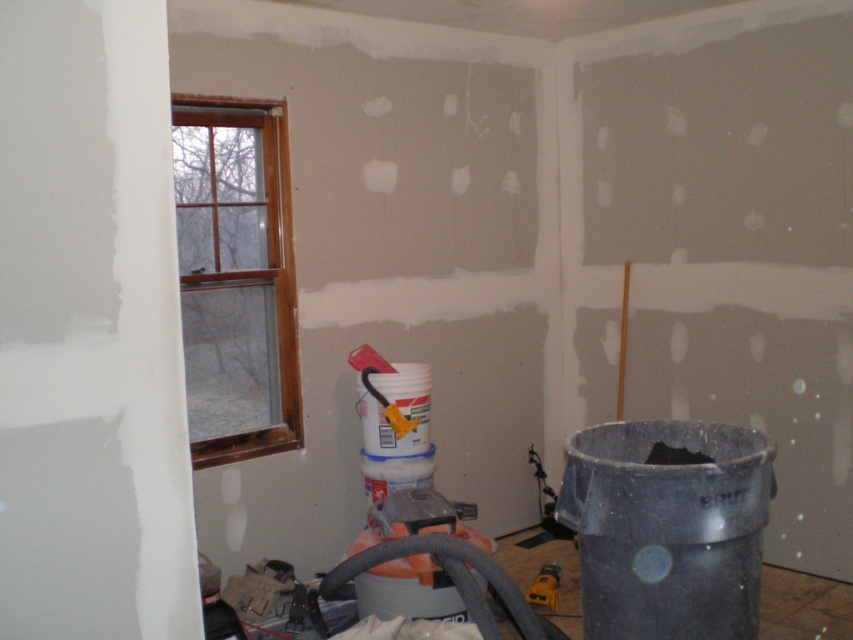
Question: Is brown wooden window at upper left above yellow plastic tool at lower center?

Choices:
 (A) no
 (B) yes

Answer: (B)

Question: Which point appears closest to the camera in this image?

Choices:
 (A) (547, 564)
 (B) (210, 362)

Answer: (B)

Question: Can you confirm if brown wooden window at upper left is positioned below yellow plastic tool at lower center?

Choices:
 (A) no
 (B) yes

Answer: (A)

Question: Among these points, which one is farthest from the camera?

Choices:
 (A) (229, 376)
 (B) (532, 588)

Answer: (A)

Question: Is brown wooden window at upper left thinner than yellow plastic tool at lower center?

Choices:
 (A) yes
 (B) no

Answer: (B)